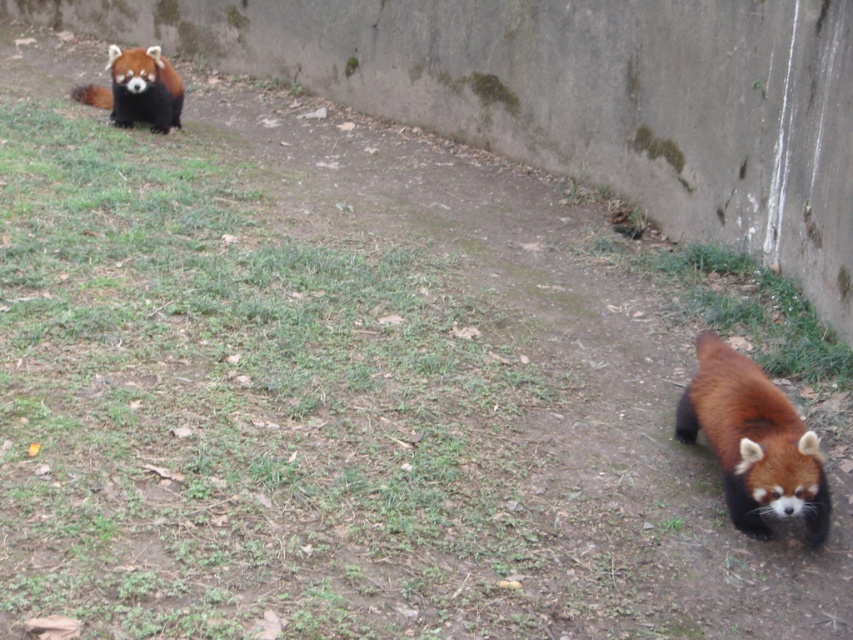
Looking at this image, is fluffy reddish-brown pelt at lower right taller than fluffy reddish-brown red panda at upper left?

Indeed, fluffy reddish-brown pelt at lower right has a greater height compared to fluffy reddish-brown red panda at upper left.

Is point (792, 499) in front of point (136, 100)?

Yes.

Between point (776, 470) and point (161, 100), which one is positioned in front?

Positioned in front is point (776, 470).

The height and width of the screenshot is (640, 853). What are the coordinates of `fluffy reddish-brown pelt at lower right` in the screenshot? It's located at (753, 442).